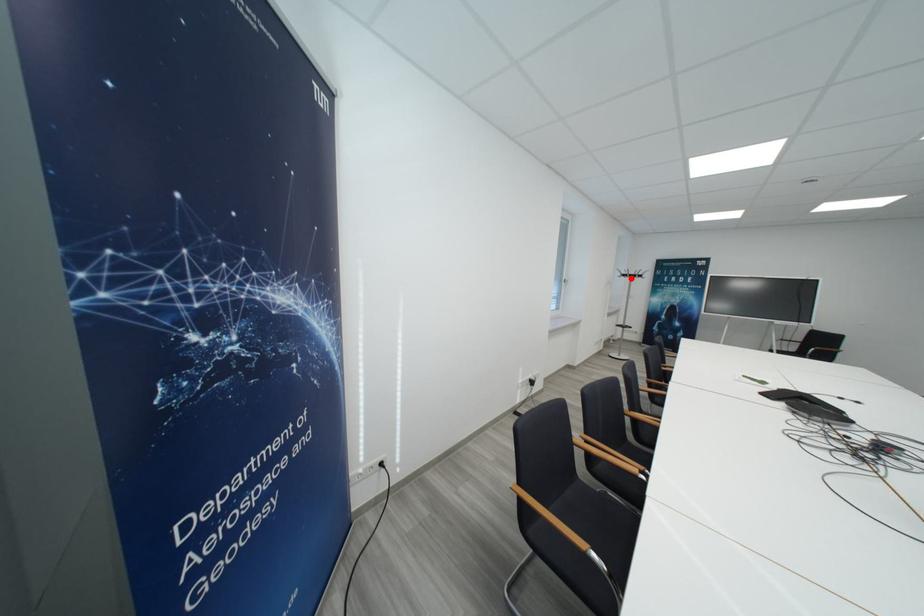
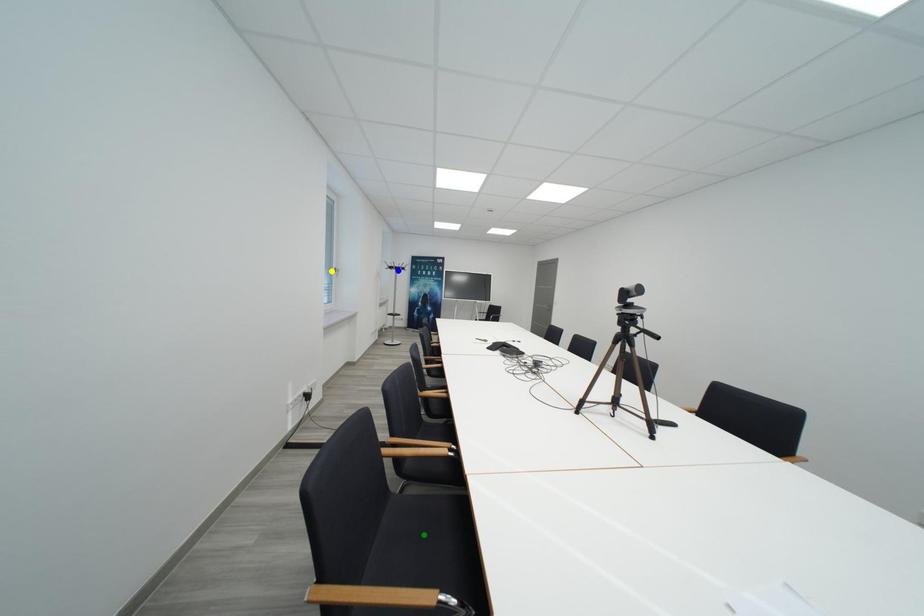
Question: I am providing you with two images of the same scene from different viewpoints. A red point is marked on the first image. You are given multiple points on the second image. Can you choose the point in image 2 that corresponds to the point in image 1?

Choices:
 (A) green point
 (B) blue point
 (C) yellow point

Answer: (B)